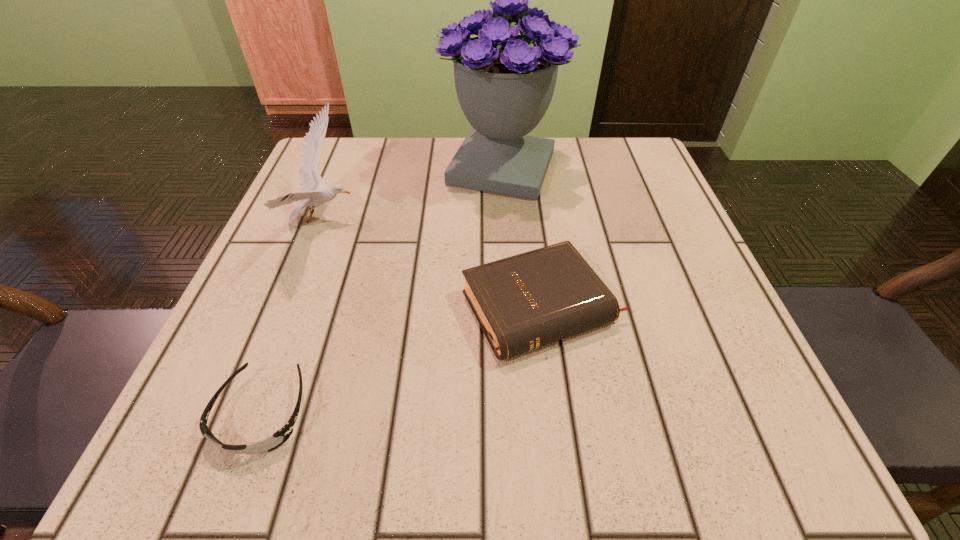
Find the location of a particular element. free space at the far left corner is located at coordinates (324, 161).

Where is `vacant space at the far right corner of the desktop`? Image resolution: width=960 pixels, height=540 pixels. vacant space at the far right corner of the desktop is located at coordinates (643, 175).

Identify the location of free space between the second tallest object and the sunglasses. (293, 317).

Identify the location of vacant space in between the bouquet and the nearest object. The image size is (960, 540). (382, 291).

The height and width of the screenshot is (540, 960). Find the location of `vacant region between the Bible and the nearest object`. vacant region between the Bible and the nearest object is located at coordinates (402, 361).

Image resolution: width=960 pixels, height=540 pixels. Find the location of `vacant area between the gull and the Bible`. vacant area between the gull and the Bible is located at coordinates (433, 264).

This screenshot has width=960, height=540. I want to click on free space between the tallest object and the Bible, so click(522, 238).

This screenshot has height=540, width=960. I want to click on vacant area that lies between the gull and the sunglasses, so click(293, 317).

Where is `free spot between the tallest object and the third tallest object`? Image resolution: width=960 pixels, height=540 pixels. free spot between the tallest object and the third tallest object is located at coordinates (522, 238).

Where is `vacant point located between the nearest object and the gull`? The image size is (960, 540). vacant point located between the nearest object and the gull is located at coordinates (293, 317).